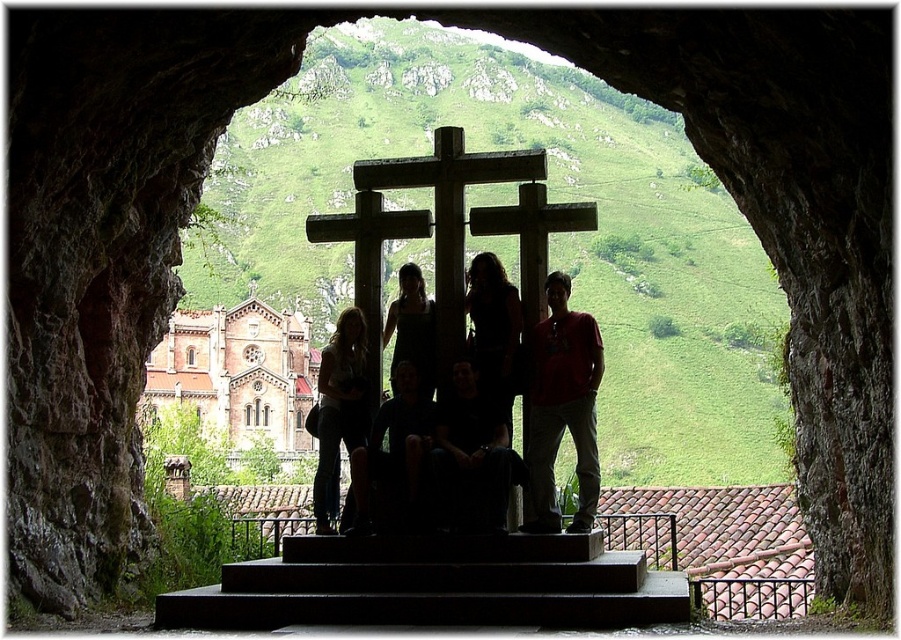
Which is behind, point (542, 323) or point (399, 328)?

The point (399, 328) is behind.

Can you confirm if red cotton shirt at center is bigger than black dress at center?

Indeed, red cotton shirt at center has a larger size compared to black dress at center.

This screenshot has height=640, width=901. In order to click on red cotton shirt at center in this screenshot , I will do `click(562, 406)`.

Who is positioned more to the left, matte black dress at center or black dress at center?

From the viewer's perspective, matte black dress at center appears more on the left side.

Is matte black dress at center below black dress at center?

Indeed, matte black dress at center is positioned under black dress at center.

Between point (331, 497) and point (393, 362), which one is positioned behind?

The point (393, 362) is more distant.

Locate an element on the screen. matte black dress at center is located at coordinates (339, 410).

Based on the photo, which is below, red cotton shirt at center or dark fabric dress at center?

red cotton shirt at center is lower down.

Is red cotton shirt at center further to the viewer compared to dark fabric dress at center?

No, red cotton shirt at center is in front of dark fabric dress at center.

This screenshot has height=640, width=901. Identify the location of red cotton shirt at center. (562, 406).

Where is `red cotton shirt at center`? Image resolution: width=901 pixels, height=640 pixels. red cotton shirt at center is located at coordinates (562, 406).